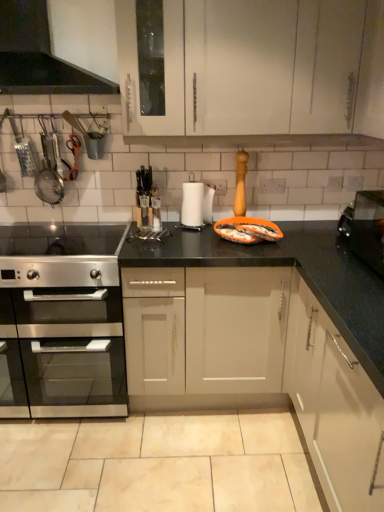
Locate an element on the screen. black stainless steel toaster at right, which is counted as the 2th appliance, starting from the top is located at coordinates [x=365, y=228].

The width and height of the screenshot is (384, 512). Describe the element at coordinates (48, 182) in the screenshot. I see `metallic strainer at left, acting as the 2th appliance starting from the front` at that location.

Measure the distance between point (39, 181) and camera.

Point (39, 181) is 7.83 feet away from camera.

At what (x,y) coordinates should I click in order to perform the action: click on black matte range hood at upper left. Please return your answer as a coordinate pair (x, y). This screenshot has width=384, height=512. Looking at the image, I should click on (38, 56).

Find the location of a particular element. The width and height of the screenshot is (384, 512). stainless steel oven at left is located at coordinates (65, 318).

In order to face matte white cabinet at center, should I rotate leftwards or rightwards?

A 9.017 degree turn to the right will do.

Find the location of a particular element. Image resolution: width=384 pixels, height=512 pixels. matte white cabinet at center is located at coordinates (288, 339).

Identify the location of black stainless steel toaster at right, which is counted as the first appliance, starting from the bottom. This screenshot has width=384, height=512. (365, 228).

How distant is satin silver gas stove at lower left from white paper towel at center?

satin silver gas stove at lower left is 66.12 centimeters from white paper towel at center.

Can you tell me how much satin silver gas stove at lower left and white paper towel at center differ in facing direction?

They differ by 0.961 degrees in their facing directions.

Locate an element on the screen. gas stove lying below the white paper towel at center (from the image's perspective) is located at coordinates (60, 239).

From a real-world perspective, is satin silver gas stove at lower left physically located above or below white paper towel at center?

Clearly, from a real-world perspective, satin silver gas stove at lower left is below white paper towel at center.

From the image's perspective, which one is positioned higher, matte white cabinet at center or satin silver gas stove at lower left?

satin silver gas stove at lower left.

Between point (323, 338) and point (101, 236), which one is positioned in front?

The point (323, 338) is more forward.

Is matte white cabinet at center turned away from satin silver gas stove at lower left?

No.

In the scene shown: Is matte white cabinet at center placed right next to satin silver gas stove at lower left?

No, matte white cabinet at center is not in contact with satin silver gas stove at lower left.

From a real-world perspective, which object rests below the other?

stainless steel oven at left.

Can you confirm if stainless steel oven at left is bigger than matte white cabinet at center?

No.

Does stainless steel oven at left come behind matte white cabinet at center?

Yes, the depth of stainless steel oven at left is greater than that of matte white cabinet at center.

Do you think stainless steel oven at left is within matte white cabinet at center, or outside of it?

stainless steel oven at left exists outside the volume of matte white cabinet at center.

Between metallic strainer at left, acting as the 2th appliance starting from the front, and stainless steel oven at left, which one has smaller width?

metallic strainer at left, acting as the 2th appliance starting from the front.

From a real-world perspective, between metallic strainer at left, the 1th appliance from the top, and stainless steel oven at left, who is vertically lower?

stainless steel oven at left is physically lower.

Is point (59, 176) closer to camera compared to point (26, 248)?

Yes, it is in front of point (26, 248).

Is metallic strainer at left, the second appliance when ordered from bottom to top, completely or partially outside of stainless steel oven at left?

Yes.

In terms of size, does metallic strainer at left, acting as the 2th appliance starting from the front, appear bigger or smaller than satin silver gas stove at lower left?

metallic strainer at left, acting as the 2th appliance starting from the front, is smaller than satin silver gas stove at lower left.

Is metallic strainer at left, the second appliance when ordered from bottom to top, touching satin silver gas stove at lower left?

No, metallic strainer at left, the second appliance when ordered from bottom to top, is not making contact with satin silver gas stove at lower left.

Identify the location of gas stove on the right of metallic strainer at left, acting as the 2th appliance starting from the front. This screenshot has width=384, height=512. (60, 239).

From the image's perspective, is metallic strainer at left, the 1th appliance from the top, above or below satin silver gas stove at lower left?

Based on their image positions, metallic strainer at left, the 1th appliance from the top, is located above satin silver gas stove at lower left.

From the image's perspective, is satin silver gas stove at lower left located above or below metallic strainer at left, the 2th appliance positioned from the right?

satin silver gas stove at lower left is situated lower than metallic strainer at left, the 2th appliance positioned from the right, in the image.

I want to click on gas stove in front of the metallic strainer at left, the 1th appliance from the top, so click(x=60, y=239).

Which object is more forward, satin silver gas stove at lower left or metallic strainer at left, which appears as the 1th appliance when viewed from the left?

satin silver gas stove at lower left is closer to the camera.

Can metallic strainer at left, the 1th appliance from the top, be found inside satin silver gas stove at lower left?

No.

I want to click on appliance that appears on the right of orange plastic tray at center, so click(365, 228).

Is orange plastic tray at center shorter than black stainless steel toaster at right, the 2th appliance from the left?

Yes, orange plastic tray at center is shorter than black stainless steel toaster at right, the 2th appliance from the left.

Relative to black stainless steel toaster at right, the 2th appliance from the left, is orange plastic tray at center in front or behind?

orange plastic tray at center is positioned farther from the viewer than black stainless steel toaster at right, the 2th appliance from the left.

There is a satin silver gas stove at lower left. Where is `paper towel above it (from a real-world perspective)`? paper towel above it (from a real-world perspective) is located at coordinates (192, 204).

Image resolution: width=384 pixels, height=512 pixels. I want to click on gas stove above the matte white cabinet at center (from the image's perspective), so click(60, 239).

Looking at the image, which one is located further to orange plastic tray at center, satin silver gas stove at lower left or matte white cabinet at center?

satin silver gas stove at lower left is positioned further to the anchor orange plastic tray at center.

Considering their positions, is orange plastic tray at center positioned further to stainless steel oven at left than matte white cabinet at center?

orange plastic tray at center lies further to stainless steel oven at left than the other object.

Estimate the real-world distances between objects in this image. Which object is further from white paper towel at center, beige matte granite at lower center or metallic strainer at left, marked as the first appliance in a back-to-front arrangement?

beige matte granite at lower center.

When comparing their distances from black matte range hood at upper left, does matte white cabinet at center or metallic strainer at left, marked as the first appliance in a back-to-front arrangement, seem further?

Among the two, matte white cabinet at center is located further to black matte range hood at upper left.

From the picture: Looking at the image, which one is located closer to metallic strainer at left, which appears as the 1th appliance when viewed from the left, matte white cabinet at center or white paper towel at center?

The object closer to metallic strainer at left, which appears as the 1th appliance when viewed from the left, is white paper towel at center.

Which object lies further to the anchor point black matte range hood at upper left, matte white cabinet at center or beige matte granite at lower center?

beige matte granite at lower center lies further to black matte range hood at upper left than the other object.

Which object lies nearer to the anchor point black stainless steel toaster at right, positioned as the 2th appliance in back-to-front order, black matte range hood at upper left or orange plastic tray at center?

orange plastic tray at center lies closer to black stainless steel toaster at right, positioned as the 2th appliance in back-to-front order, than the other object.

Considering their positions, is metallic strainer at left, marked as the first appliance in a back-to-front arrangement, positioned further to beige matte granite at lower center than stainless steel oven at left?

Based on the image, metallic strainer at left, marked as the first appliance in a back-to-front arrangement, appears to be further to beige matte granite at lower center.

Where is `tray situated between satin silver gas stove at lower left and matte white cabinet at center from left to right`? The width and height of the screenshot is (384, 512). tray situated between satin silver gas stove at lower left and matte white cabinet at center from left to right is located at coordinates (247, 230).

Identify the location of home appliance between metallic strainer at left, the second appliance when ordered from bottom to top, and white paper towel at center from left to right. (38, 56).

Locate an element on the screen. tray between stainless steel oven at left and black stainless steel toaster at right, which is counted as the first appliance, starting from the bottom, in the horizontal direction is located at coordinates (247, 230).

The image size is (384, 512). I want to click on paper towel between stainless steel oven at left and black stainless steel toaster at right, positioned as the 2th appliance in back-to-front order, so click(192, 204).